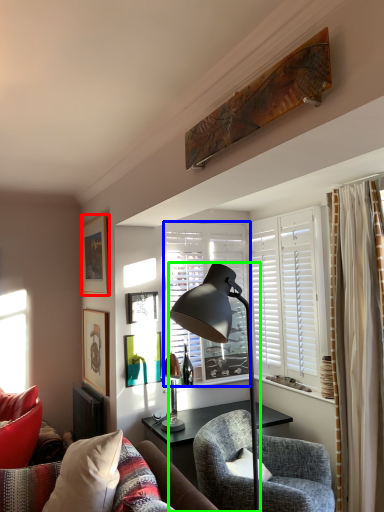
Question: Estimate the real-world distances between objects in this image. Which object is closer to picture frame (highlighted by a red box), window (highlighted by a blue box) or lamp (highlighted by a green box)?

Choices:
 (A) window
 (B) lamp

Answer: (A)